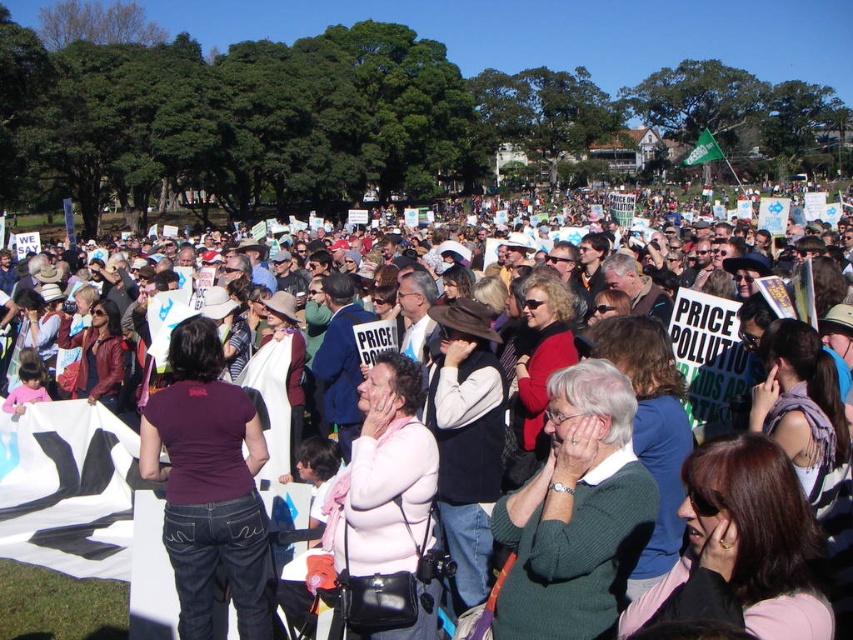
You are a photographer trying to capture a wide shot of the protest crowd. You notice the pink fabric at center and the green sweater at center in your frame. Which object should you focus on to ensure both are visible without cropping, considering their sizes?

The pink fabric at center has a larger width than the green sweater at center, so focusing on the pink fabric at center would allow both objects to fit within the frame since it accommodates the larger size.

You are a photographer standing in the park and want to take a photo of the protest. You notice two points in the crowd labeled as point (90, 518) and point (608, 380). Which point will appear closer to the camera in your photo?

Point (90, 518) is further to the camera than point (608, 380), so the point (90, 518) will appear closer to the camera in the photo.

You are a photographer at the park and want to capture a photo of the green sweater at center without the pink fabric at center blocking it. How should you adjust your position?

Move forward to get closer to the green sweater at center so that it is no longer behind the pink fabric at center.